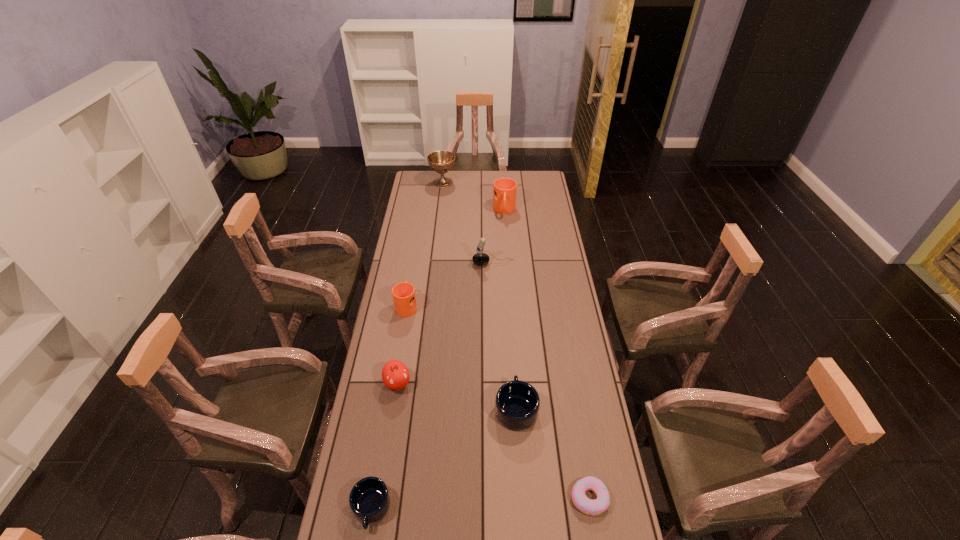
Locate an element on the screen. This screenshot has width=960, height=540. vacant space in between the third shortest mug and the right orange mug is located at coordinates (456, 258).

At what (x,y) coordinates should I click in order to perform the action: click on free space between the chalice and the shortest mug. Please return your answer as a coordinate pair (x, y). This screenshot has width=960, height=540. Looking at the image, I should click on (407, 346).

Locate an element on the screen. vacant space that is in between the chalice and the white microphone is located at coordinates (468, 223).

Where is `object that can be found as the seventh closest to the red apple`? The height and width of the screenshot is (540, 960). object that can be found as the seventh closest to the red apple is located at coordinates (440, 161).

Identify the location of object that is the third closest to the smaller blue mug. tap(588, 506).

Select which mug appears as the third closest to the smaller orange mug. Please provide its 2D coordinates. Your answer should be formatted as a tuple, i.e. [(x, y)], where the tuple contains the x and y coordinates of a point satisfying the conditions above.

[(369, 499)]

Point out which mug is positioned as the nearest to the second farthest mug. Please provide its 2D coordinates. Your answer should be formatted as a tuple, i.e. [(x, y)], where the tuple contains the x and y coordinates of a point satisfying the conditions above.

[(517, 403)]

Locate an element on the screen. Image resolution: width=960 pixels, height=540 pixels. free location that satisfies the following two spatial constraints: 1. on the handle side of the left orange mug; 2. on the left side of the sixth nearest object is located at coordinates (414, 263).

I want to click on vacant point that satisfies the following two spatial constraints: 1. on the front side of the rightmost object; 2. on the left side of the red apple, so click(379, 498).

At what (x,y) coordinates should I click in order to perform the action: click on free space that satisfies the following two spatial constraints: 1. on the front side of the chalice; 2. on the right side of the rightmost object. Please return your answer as a coordinate pair (x, y). The width and height of the screenshot is (960, 540). Looking at the image, I should click on (406, 498).